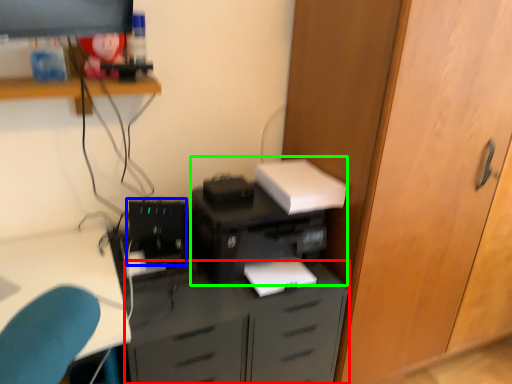
Question: Which is farther away from cabinetry (highlighted by a red box)? computer tower (highlighted by a blue box) or printer (highlighted by a green box)?

Choices:
 (A) computer tower
 (B) printer

Answer: (A)